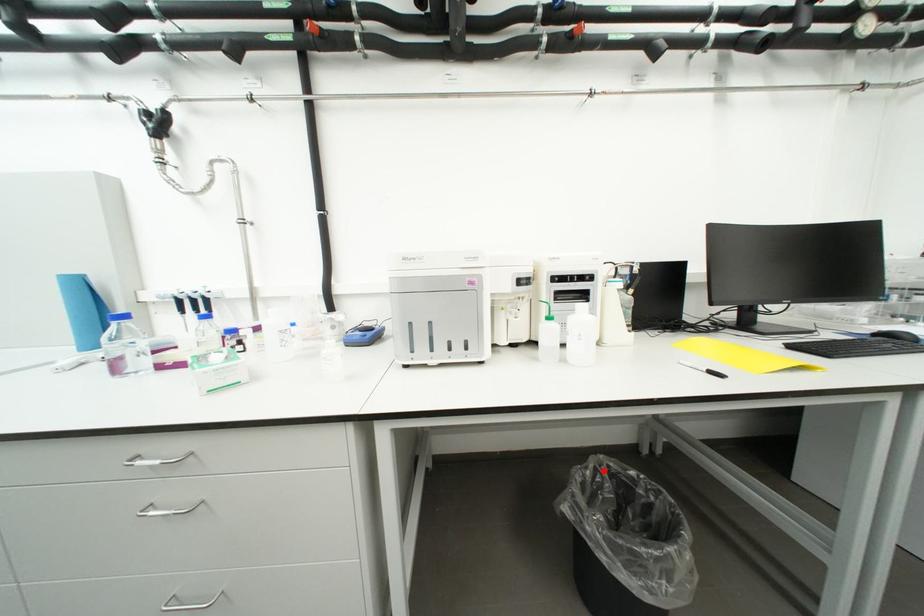
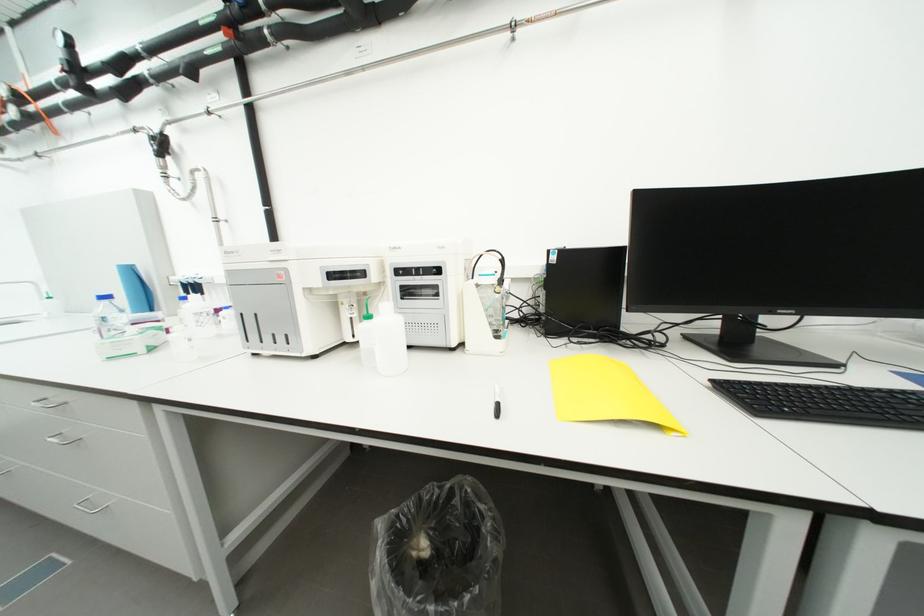
The point at the highlighted location is marked in the first image. Where is the corresponding point in the second image?

(459, 493)